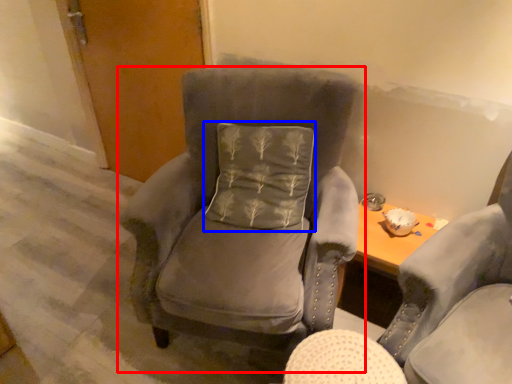
Question: Which of the following is the closest to the observer, chair (highlighted by a red box) or pillow (highlighted by a blue box)?

Choices:
 (A) chair
 (B) pillow

Answer: (A)